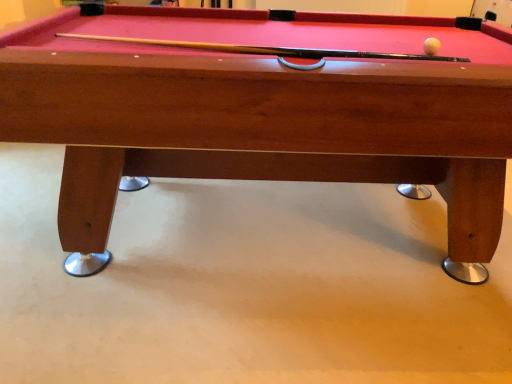
Identify the location of free area below wooden billiard table at center (from a real-world perspective). The height and width of the screenshot is (384, 512). (275, 227).